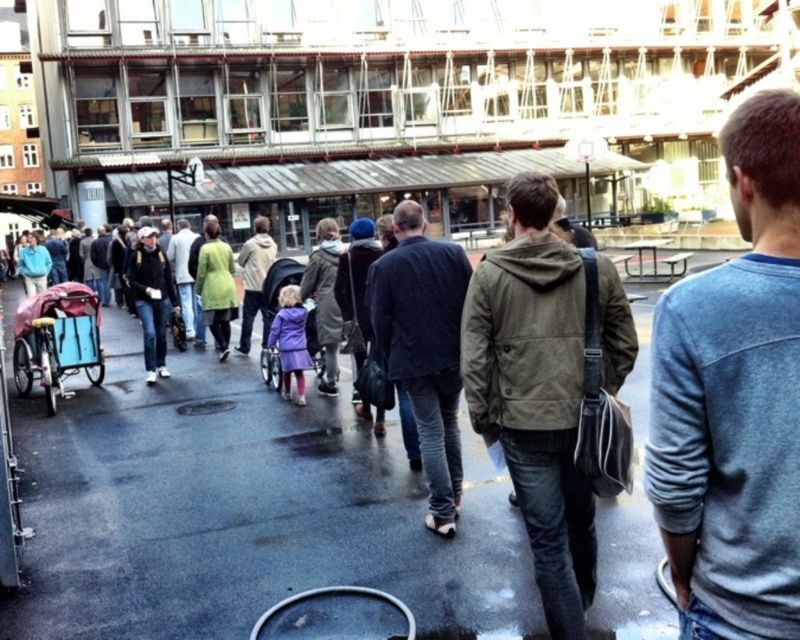
Question: Is blue cotton sweater at upper right bigger than dark blue corduroy jacket at center?

Choices:
 (A) no
 (B) yes

Answer: (A)

Question: Which point appears closest to the camera in this image?

Choices:
 (A) (189, 241)
 (B) (732, 390)
 (C) (92, 371)

Answer: (B)

Question: Which object is farther from the camera taking this photo?

Choices:
 (A) green fabric coat at center
 (B) blue fabric baby carriage at left
 (C) blue cotton sweater at upper right

Answer: (A)

Question: Does dark blue corduroy jacket at center have a lesser width compared to blue fabric baby carriage at left?

Choices:
 (A) yes
 (B) no

Answer: (B)

Question: Which object is farther from the camera taking this photo?

Choices:
 (A) green fabric coat at center
 (B) smooth asphalt pavement at center
 (C) blue cotton sweater at upper right
 (D) blue fabric baby carriage at left

Answer: (A)

Question: Can you confirm if blue cotton sweater at upper right is positioned to the left of blue fabric baby carriage at left?

Choices:
 (A) yes
 (B) no

Answer: (B)